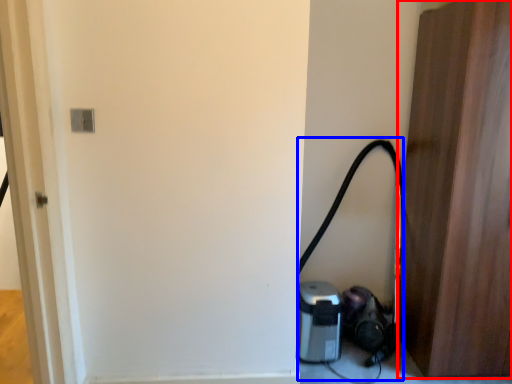
Question: Which object is closer to the camera taking this photo, door (highlighted by a red box) or garden hose (highlighted by a blue box)?

Choices:
 (A) door
 (B) garden hose

Answer: (A)